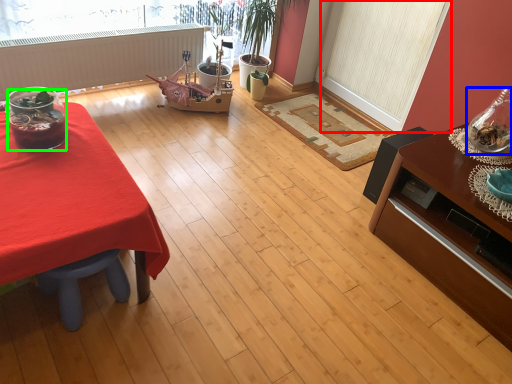
Question: Based on their relative distances, which object is nearer to screen door (highlighted by a red box)? Choose from glass vase (highlighted by a blue box) and food (highlighted by a green box).

Choices:
 (A) glass vase
 (B) food

Answer: (A)